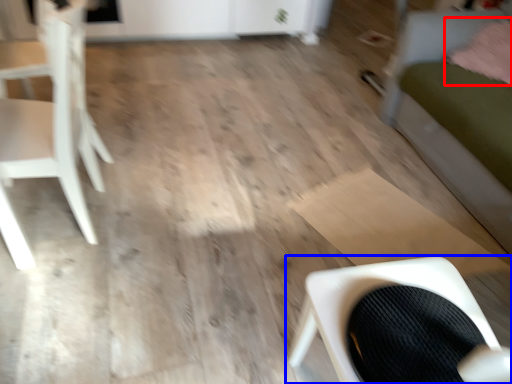
Question: Which object appears closest to the camera in this image, pillow (highlighted by a red box) or chair (highlighted by a blue box)?

Choices:
 (A) pillow
 (B) chair

Answer: (B)